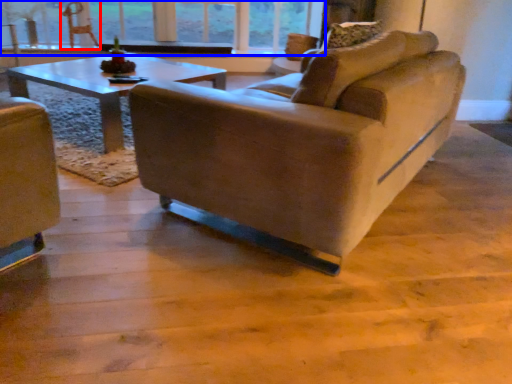
Question: Which object appears farthest to the camera in this image, swivel chair (highlighted by a red box) or window (highlighted by a blue box)?

Choices:
 (A) swivel chair
 (B) window

Answer: (B)